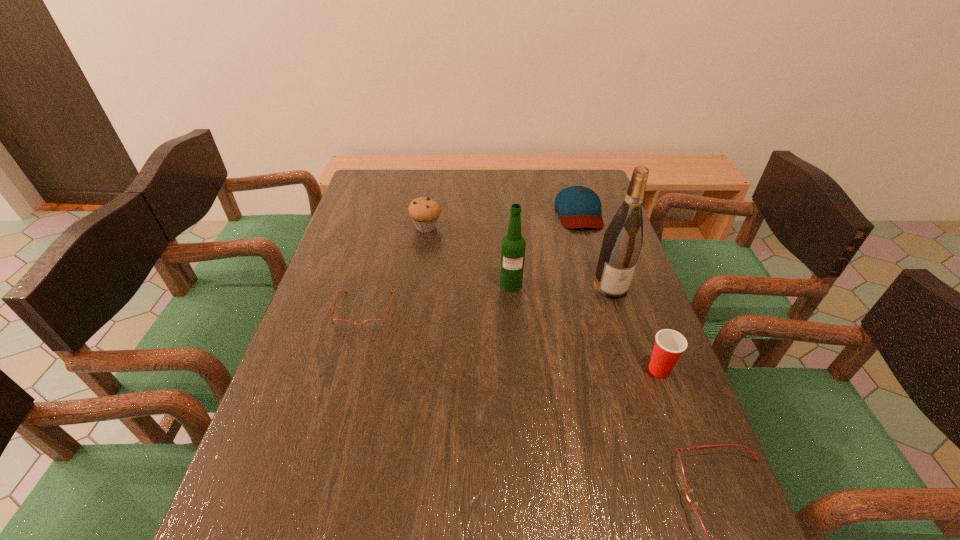
The width and height of the screenshot is (960, 540). I want to click on free space located on the label of the second tallest object, so click(518, 381).

You are a GUI agent. You are given a task and a screenshot of the screen. Output one action in this format:
    pyautogui.click(x=<x>, y=<y>)
    Task: Click on the free space located 0.360m on the left of the wine bottle
    
    Given the screenshot: What is the action you would take?
    pyautogui.click(x=464, y=287)

Where is `blank area located on the back of the muffin`? blank area located on the back of the muffin is located at coordinates (430, 200).

You are a GUI agent. You are given a task and a screenshot of the screen. Output one action in this format:
    pyautogui.click(x=<x>, y=<y>)
    Task: Click on the free space located on the left of the sixth farthest object
    The width and height of the screenshot is (960, 540).
    Given the screenshot: What is the action you would take?
    pyautogui.click(x=602, y=369)

Image resolution: width=960 pixels, height=540 pixels. I want to click on object that is at the far edge, so click(x=579, y=207).

Locate an element on the screen. The width and height of the screenshot is (960, 540). object present at the left edge is located at coordinates (374, 323).

Identify the location of baseball cap at the right edge. (579, 207).

Locate an element on the screen. The width and height of the screenshot is (960, 540). wine bottle that is at the right edge is located at coordinates (623, 239).

Locate an element on the screen. This screenshot has height=540, width=960. Dixie cup located at the right edge is located at coordinates (669, 345).

Locate an element on the screen. object that is at the far right corner is located at coordinates (579, 207).